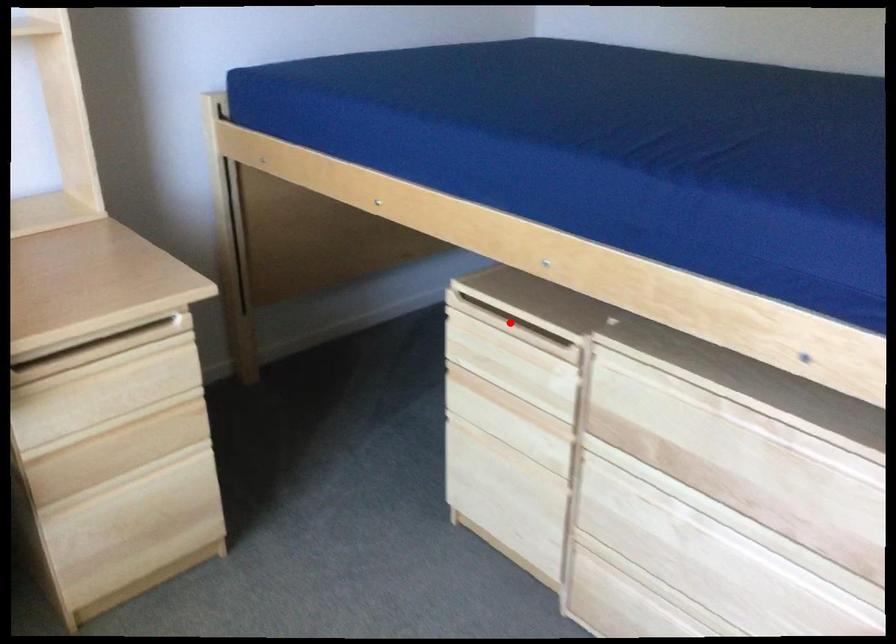
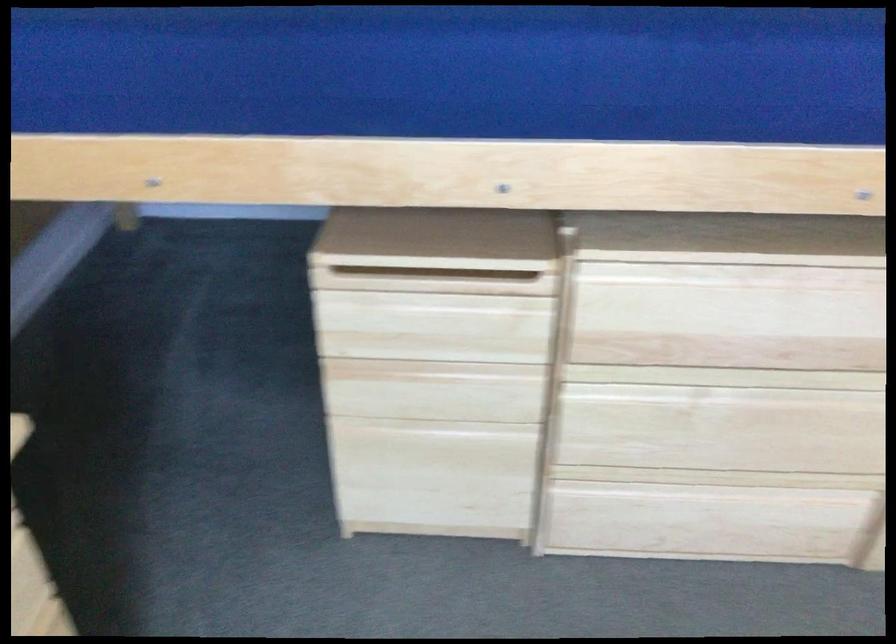
Where in the second image is the point corresponding to the highlighted location from the first image?

(432, 279)